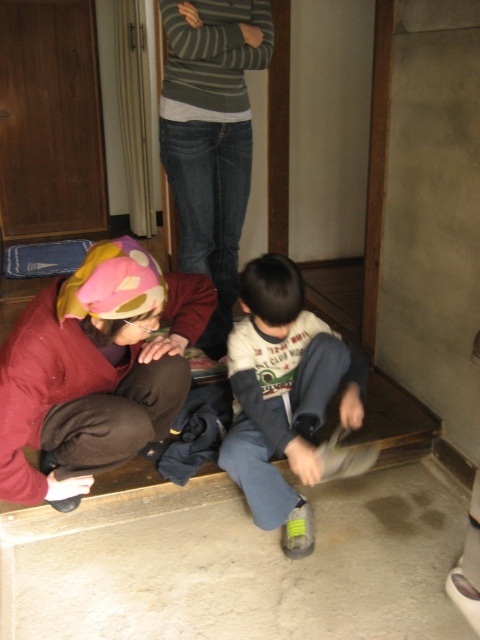
Which is behind, point (113, 356) or point (342, 397)?

The point (342, 397) is more distant.

Does brown fabric at lower left appear on the left side of white cotton shirt at center?

Yes, brown fabric at lower left is to the left of white cotton shirt at center.

This screenshot has height=640, width=480. I want to click on brown fabric at lower left, so click(96, 369).

Does brown fabric at lower left appear under striped sweater at center?

Yes, brown fabric at lower left is below striped sweater at center.

Can you confirm if brown fabric at lower left is smaller than striped sweater at center?

Yes.

Image resolution: width=480 pixels, height=640 pixels. What are the coordinates of `brown fabric at lower left` in the screenshot? It's located at (96, 369).

Which is more to the left, striped sweater at center or white cotton shirt at center?

striped sweater at center is more to the left.

In the scene shown: Who is higher up, striped sweater at center or white cotton shirt at center?

striped sweater at center is above.

Between point (228, 225) and point (314, 401), which one is positioned in front?

Point (314, 401) is more forward.

Where is `striped sweater at center`? striped sweater at center is located at coordinates (211, 138).